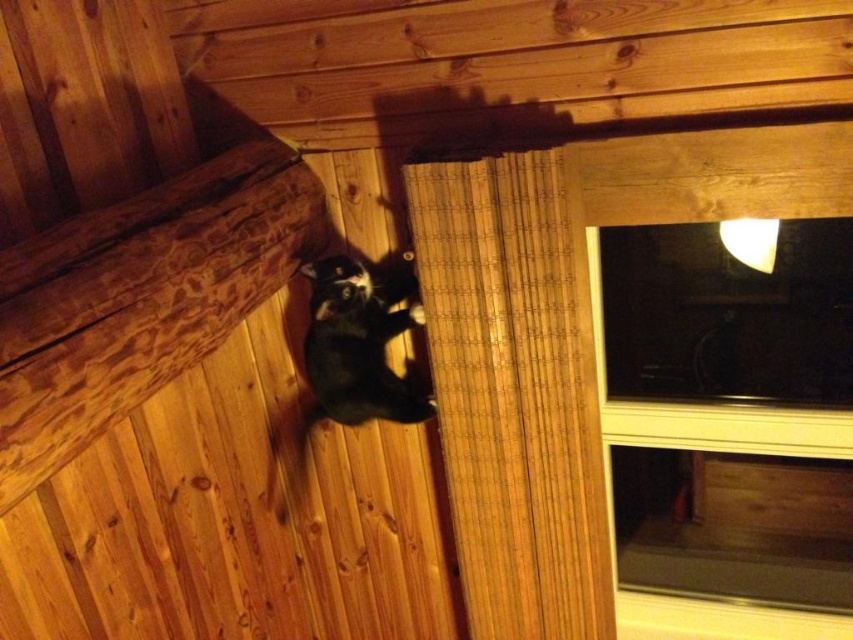
Question: Can you confirm if transparent glass window at upper right is positioned above bamboo curtain at upper center?

Choices:
 (A) no
 (B) yes

Answer: (A)

Question: Among these objects, which one is farthest from the camera?

Choices:
 (A) transparent glass window at upper right
 (B) black fur cat at center
 (C) bamboo curtain at upper center

Answer: (B)

Question: Can you confirm if bamboo curtain at upper center is positioned above black fur cat at center?

Choices:
 (A) yes
 (B) no

Answer: (B)

Question: Does transparent glass window at upper right appear on the left side of bamboo curtain at upper center?

Choices:
 (A) no
 (B) yes

Answer: (A)

Question: Which object is the farthest from the black fur cat at center?

Choices:
 (A) transparent glass window at upper right
 (B) bamboo curtain at upper center

Answer: (A)

Question: Which point is farther to the camera?

Choices:
 (A) (576, 508)
 (B) (714, 317)

Answer: (B)